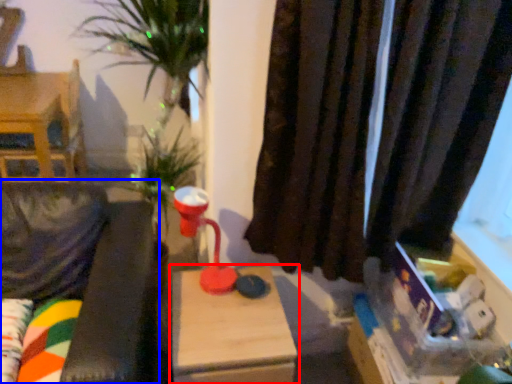
Question: Which of the following is the farthest to the observer, table (highlighted by a red box) or couch (highlighted by a blue box)?

Choices:
 (A) table
 (B) couch

Answer: (A)